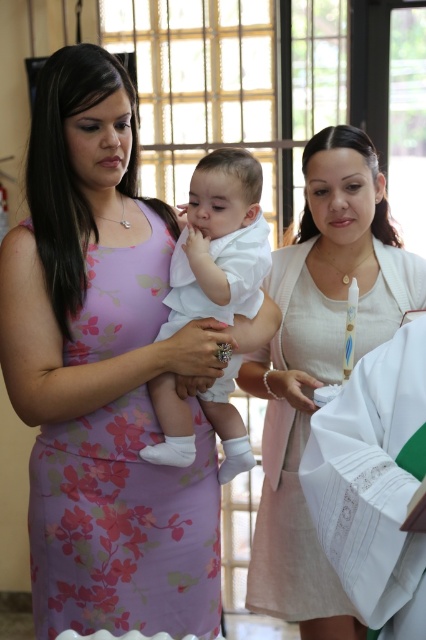
Does floral printed dress at center have a greater height compared to white cotton baby at center?

Correct, floral printed dress at center is much taller as white cotton baby at center.

Does point (213, 449) come behind point (230, 157)?

Yes, it is behind point (230, 157).

Does point (97, 486) lie behind point (244, 307)?

That is False.

The width and height of the screenshot is (426, 640). Identify the location of floral printed dress at center. (123, 525).

Between point (370, 304) and point (229, 308), which one is positioned behind?

The point (370, 304) is behind.

Does point (287, 422) come farther from viewer compared to point (235, 440)?

Yes, point (287, 422) is behind point (235, 440).

Which is behind, point (255, 600) or point (230, 177)?

Positioned behind is point (255, 600).

At what (x,y) coordinates should I click in order to perform the action: click on white textured dress at center. Please return your answer as a coordinate pair (x, y). Looking at the image, I should click on (321, 364).

Is point (161, 557) positioned in front of point (371, 154)?

Yes, point (161, 557) is closer to viewer.

You are a GUI agent. You are given a task and a screenshot of the screen. Output one action in this format:
    pyautogui.click(x=<x>, y=<y>)
    Task: Click on the floral printed dress at center
    The height and width of the screenshot is (640, 426).
    Given the screenshot: What is the action you would take?
    pyautogui.click(x=123, y=525)